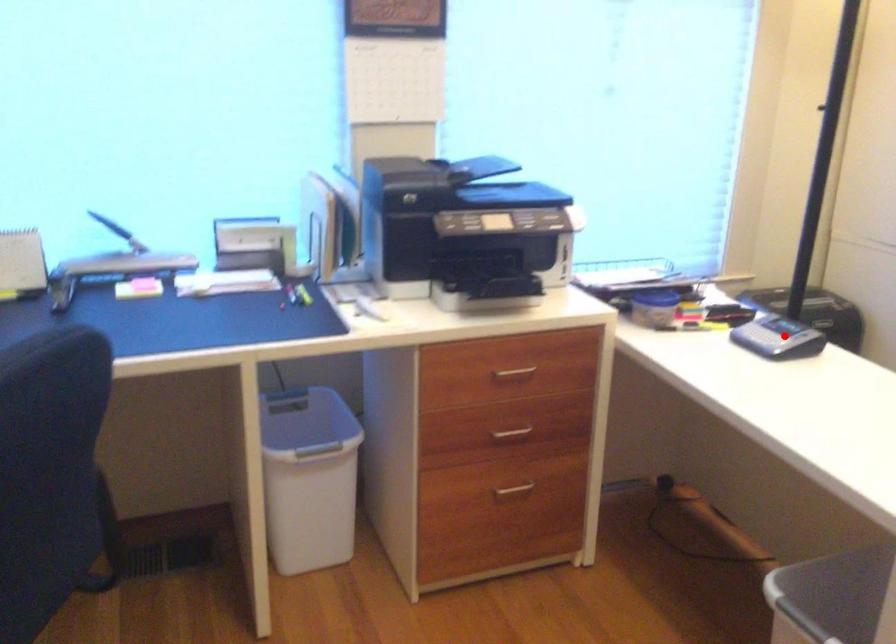
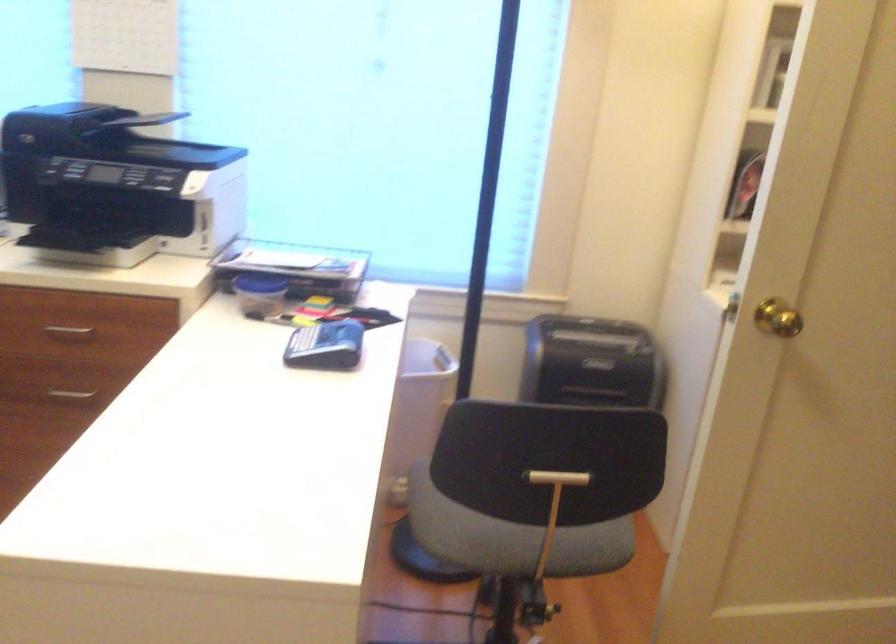
Question: I am providing you with two images of the same scene from different viewpoints. A red point is shown in image1. For the corresponding object point in image2, is it positioned nearer or farther from the camera?

Choices:
 (A) Nearer
 (B) Farther

Answer: (A)